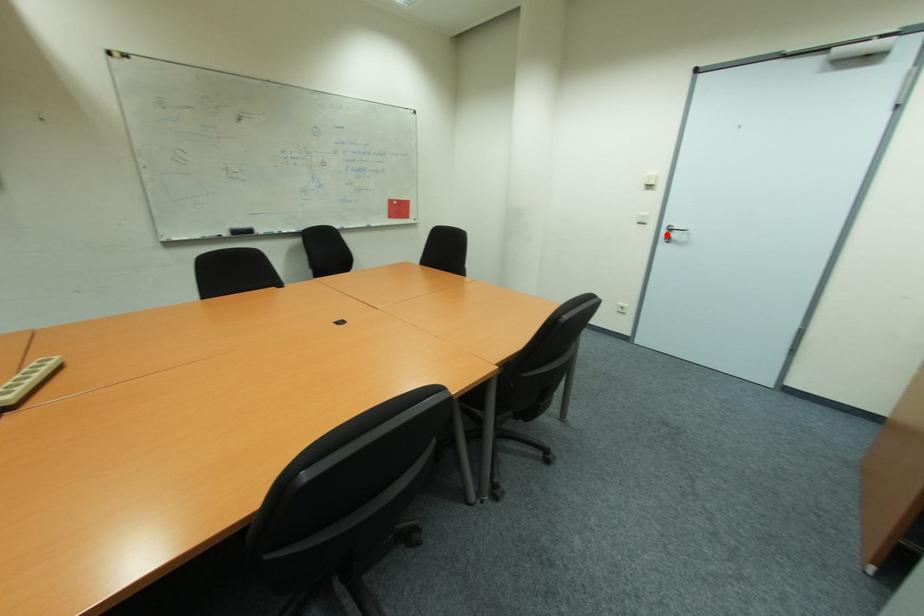
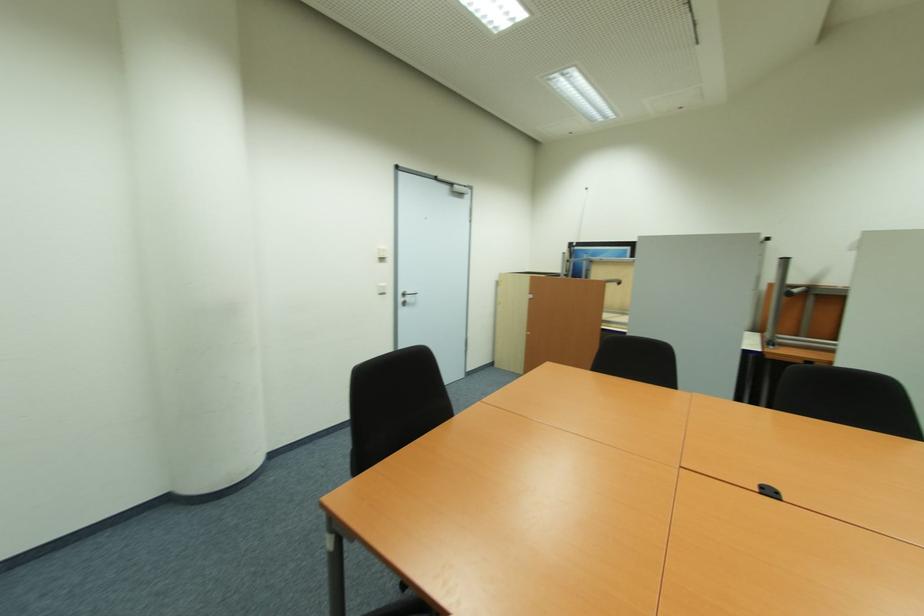
Where in the second image is the point corresponding to the highlighted location from the first image?

(405, 300)